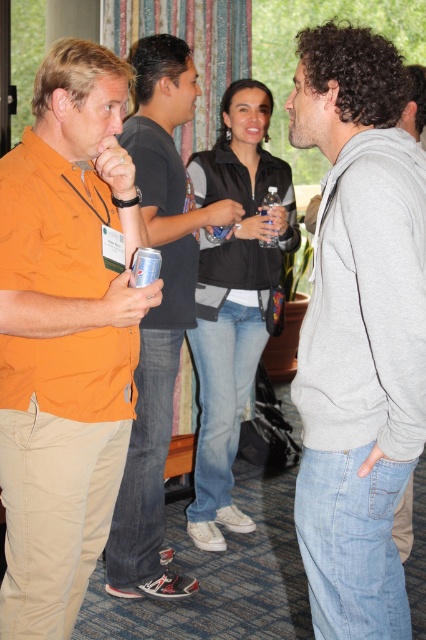
Question: Which object is closer to the camera taking this photo?

Choices:
 (A) orange cotton shirt at left
 (B) gray cotton hoodie at center

Answer: (B)

Question: Can you confirm if orange cotton shirt at left is wider than metallic can at center?

Choices:
 (A) yes
 (B) no

Answer: (A)

Question: Which of the following is the closest to the observer?

Choices:
 (A) gray cotton hoodie at center
 (B) orange matte shirt at left

Answer: (A)

Question: Does orange cotton shirt at left come in front of metallic can at center?

Choices:
 (A) no
 (B) yes

Answer: (B)

Question: Does orange matte shirt at left have a greater width compared to clear plastic bottle at center?

Choices:
 (A) no
 (B) yes

Answer: (B)

Question: Which point is farther to the camera?

Choices:
 (A) orange cotton shirt at left
 (B) gray cotton hoodie at center
 (C) clear plastic bottle at center
 (D) metallic can at center

Answer: (C)